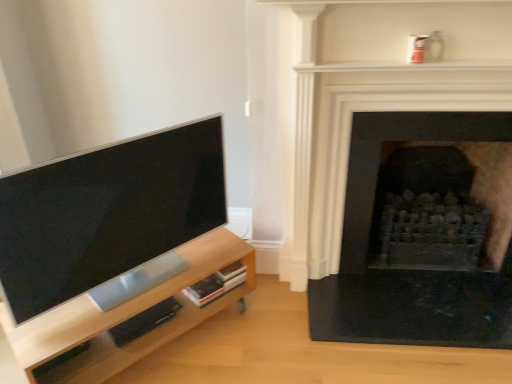
What are the coordinates of `free space on the front side of black stone fireplace at right, the second fireplace positioned from the front` in the screenshot? It's located at (434, 319).